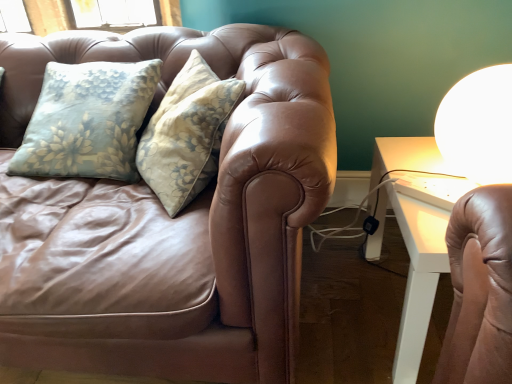
Question: From a real-world perspective, is white glossy table lamp at upper right positioned under leather couch at left based on gravity?

Choices:
 (A) no
 (B) yes

Answer: (A)

Question: From the image's perspective, is white glossy table lamp at upper right below leather couch at left?

Choices:
 (A) yes
 (B) no

Answer: (B)

Question: From a real-world perspective, is white glossy table lamp at upper right on top of leather couch at left?

Choices:
 (A) no
 (B) yes

Answer: (B)

Question: Does white glossy table lamp at upper right appear on the right side of leather couch at left?

Choices:
 (A) yes
 (B) no

Answer: (A)

Question: Is white glossy table lamp at upper right at the left side of leather couch at left?

Choices:
 (A) yes
 (B) no

Answer: (B)

Question: Is white glossy table lamp at upper right oriented towards leather couch at left?

Choices:
 (A) yes
 (B) no

Answer: (B)

Question: Considering the relative sizes of leather couch at left and white glossy table lamp at upper right in the image provided, is leather couch at left taller than white glossy table lamp at upper right?

Choices:
 (A) no
 (B) yes

Answer: (B)

Question: Could you tell me if leather couch at left is facing white glossy table lamp at upper right?

Choices:
 (A) no
 (B) yes

Answer: (A)

Question: Can you confirm if leather couch at left is shorter than white glossy table lamp at upper right?

Choices:
 (A) no
 (B) yes

Answer: (A)

Question: Can you confirm if leather couch at left is positioned to the left of white glossy table lamp at upper right?

Choices:
 (A) yes
 (B) no

Answer: (A)

Question: Does leather couch at left have a lesser width compared to white glossy table lamp at upper right?

Choices:
 (A) yes
 (B) no

Answer: (B)

Question: From the image's perspective, is leather couch at left below white glossy table lamp at upper right?

Choices:
 (A) no
 (B) yes

Answer: (B)

Question: Considering the positions of white glossy table lamp at upper right and leather couch at left in the image, is white glossy table lamp at upper right bigger or smaller than leather couch at left?

Choices:
 (A) big
 (B) small

Answer: (B)